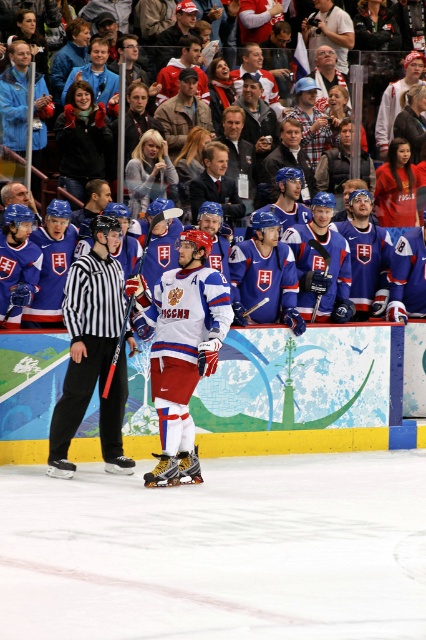
Based on the coordinates provided, which object is located at point (183, 349) in the image?

The point (183, 349) corresponds to the white matte jersey at center.

You are an ice hockey player standing on the ice rink. You notice two points marked on the ice. The first point is at coordinates point (181, 378) and the second point is at coordinates point (80, 387). Which point is closer to you?

Point (181, 378) is closer to the viewer than point (80, 387).